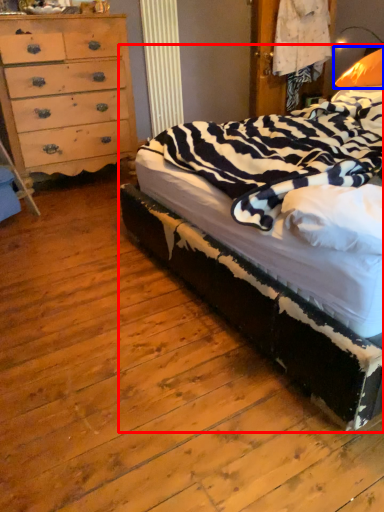
Question: Which object appears closest to the camera in this image, bed (highlighted by a red box) or pillow (highlighted by a blue box)?

Choices:
 (A) bed
 (B) pillow

Answer: (A)